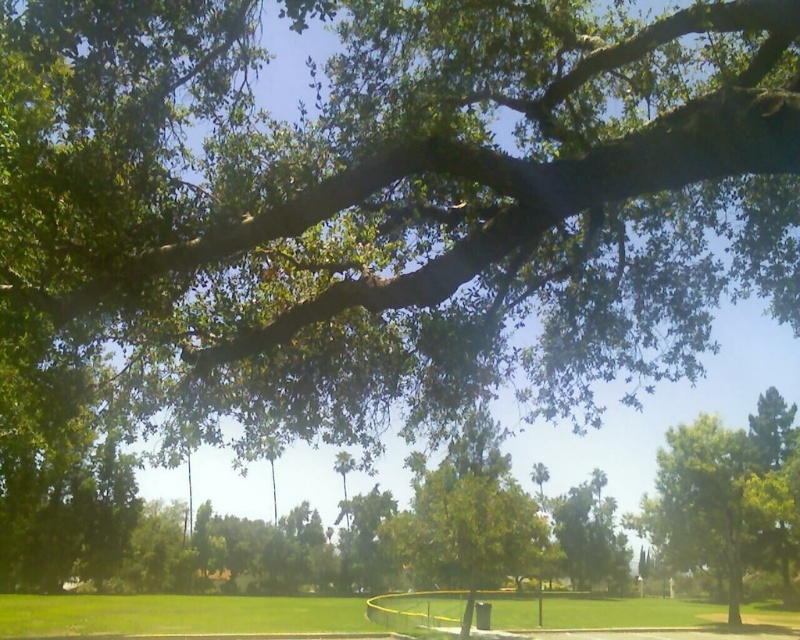
Between green leafy tree at center and green grass at lower center, which one has less height?

Standing shorter between the two is green grass at lower center.

Is point (782, 428) in front of point (136, 609)?

That is False.

Which is in front, point (676, 438) or point (250, 621)?

Point (250, 621) is in front.

Where is `green leafy tree at center`? The height and width of the screenshot is (640, 800). green leafy tree at center is located at coordinates (729, 497).